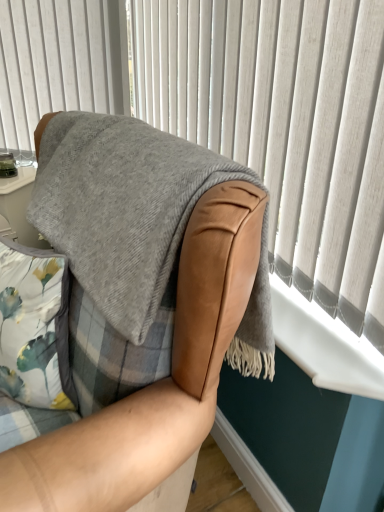
Locate an element on the screen. gray woolen blanket at upper right is located at coordinates (285, 126).

From a real-world perspective, which is physically above, gray woolen blanket at upper right or white plastic window sill at lower right?

gray woolen blanket at upper right, from a real-world perspective.

Is there a large distance between gray woolen blanket at upper right and white plastic window sill at lower right?

They are positioned close to each other.

From their relative heights in the image, would you say gray woolen blanket at upper right is taller or shorter than white plastic window sill at lower right?

In the image, gray woolen blanket at upper right appears to be taller than white plastic window sill at lower right.

Can you confirm if gray woolen blanket at upper right is thinner than white plastic window sill at lower right?

Indeed, gray woolen blanket at upper right has a lesser width compared to white plastic window sill at lower right.

How different are the orientations of leather armchair at center and white plastic window sill at lower right in degrees?

There is a 1-degree angle between the facing directions of leather armchair at center and white plastic window sill at lower right.

From a real-world perspective, is leather armchair at center above or below white plastic window sill at lower right?

Clearly, from a real-world perspective, leather armchair at center is below white plastic window sill at lower right.

Consider the image. Which object is further away from the camera, leather armchair at center or white plastic window sill at lower right?

white plastic window sill at lower right is more distant.

Is leather armchair at center placed right next to white plastic window sill at lower right?

leather armchair at center is not next to white plastic window sill at lower right, and they're not touching.

From the picture: Is gray woolen blanket at upper right positioned behind leather armchair at center?

Yes, gray woolen blanket at upper right is further from the camera.

Is gray woolen blanket at upper right outside of leather armchair at center?

That's correct, gray woolen blanket at upper right is outside of leather armchair at center.

Find the location of `curtain that is behind the leather armchair at center`. curtain that is behind the leather armchair at center is located at coordinates (285, 126).

Consider the image. From the image's perspective, is gray woolen blanket at upper right located beneath leather armchair at center?

Actually, gray woolen blanket at upper right appears above leather armchair at center in the image.

Does white plastic window sill at lower right appear on the left side of leather armchair at center?

Incorrect, white plastic window sill at lower right is not on the left side of leather armchair at center.

Is white plastic window sill at lower right not near leather armchair at center?

No, white plastic window sill at lower right is in close proximity to leather armchair at center.

Where is `window sill that is behind the leather armchair at center`? window sill that is behind the leather armchair at center is located at coordinates (324, 345).

Based on the photo, from the image's perspective, which one is positioned lower, white plastic window sill at lower right or leather armchair at center?

From the image's view, leather armchair at center is below.

From the image's perspective, between white plastic window sill at lower right and gray woolen blanket at upper right, which one is located above?

gray woolen blanket at upper right.

How different are the orientations of white plastic window sill at lower right and gray woolen blanket at upper right in degrees?

0.704 degrees.

In the scene shown: Considering the relative sizes of white plastic window sill at lower right and gray woolen blanket at upper right in the image provided, is white plastic window sill at lower right bigger than gray woolen blanket at upper right?

Incorrect, white plastic window sill at lower right is not larger than gray woolen blanket at upper right.

From a real-world perspective, is leather armchair at center above or below gray woolen blanket at upper right?

From a real-world perspective, leather armchair at center is physically below gray woolen blanket at upper right.

Is leather armchair at center smaller than gray woolen blanket at upper right?

No, leather armchair at center is not smaller than gray woolen blanket at upper right.

Does leather armchair at center have a lesser height compared to gray woolen blanket at upper right?

Incorrect, the height of leather armchair at center does not fall short of that of gray woolen blanket at upper right.

Is leather armchair at center wider or thinner than gray woolen blanket at upper right?

Considering their sizes, leather armchair at center looks broader than gray woolen blanket at upper right.

Locate an element on the screen. window sill on the right of the gray woolen blanket at upper right is located at coordinates (324, 345).

The width and height of the screenshot is (384, 512). What are the coordinates of `chair that is on the left side of white plastic window sill at lower right` in the screenshot? It's located at (157, 382).

Estimate the real-world distances between objects in this image. Which object is closer to gray woolen blanket at upper right, leather armchair at center or white plastic window sill at lower right?

Based on the image, white plastic window sill at lower right appears to be nearer to gray woolen blanket at upper right.

Based on their spatial positions, is gray woolen blanket at upper right or leather armchair at center closer to white plastic window sill at lower right?

Among the two, gray woolen blanket at upper right is located nearer to white plastic window sill at lower right.

When comparing their distances from white plastic window sill at lower right, does leather armchair at center or gray woolen blanket at upper right seem further?

leather armchair at center is positioned further to the anchor white plastic window sill at lower right.

Looking at the image, which one is located further to leather armchair at center, gray woolen blanket at upper right or white plastic window sill at lower right?

Based on the image, gray woolen blanket at upper right appears to be further to leather armchair at center.

Which object lies further to the anchor point gray woolen blanket at upper right, white plastic window sill at lower right or leather armchair at center?

Among the two, leather armchair at center is located further to gray woolen blanket at upper right.

In the scene shown: Which object lies further to the anchor point leather armchair at center, white plastic window sill at lower right or gray woolen blanket at upper right?

gray woolen blanket at upper right lies further to leather armchair at center than the other object.

The width and height of the screenshot is (384, 512). Identify the location of window sill between gray woolen blanket at upper right and leather armchair at center vertically. (324, 345).